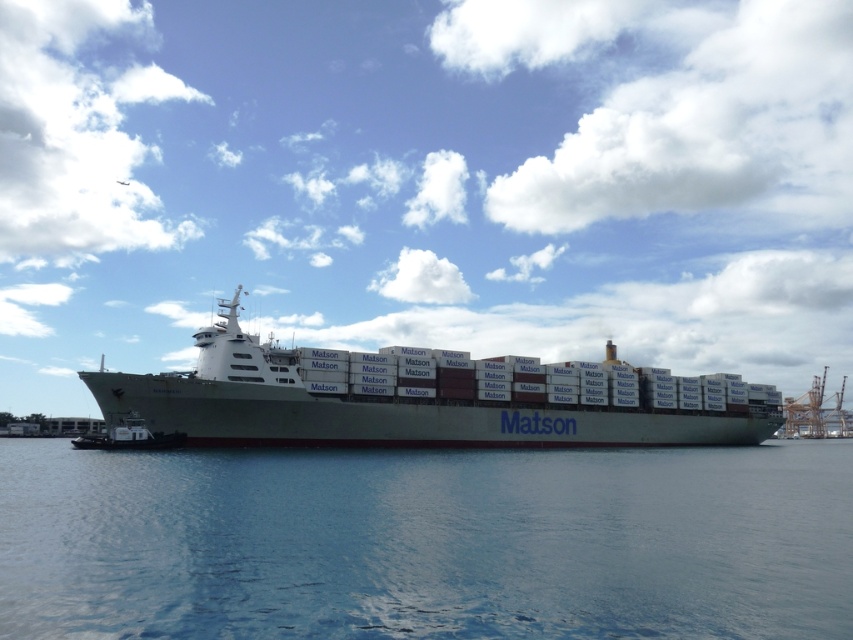
Who is lower down, blue water at center or white matte container ship at center?

Positioned lower is blue water at center.

Which of these two, blue water at center or white matte container ship at center, stands taller?

With more height is white matte container ship at center.

Image resolution: width=853 pixels, height=640 pixels. I want to click on blue water at center, so click(426, 541).

Identify the location of blue water at center. (426, 541).